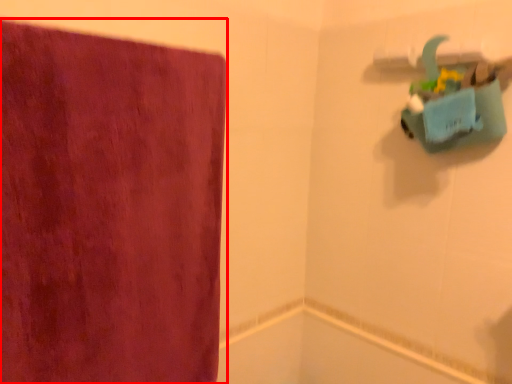
Question: In this image, where is towel (annotated by the red box) located relative to bath?

Choices:
 (A) left
 (B) right

Answer: (A)